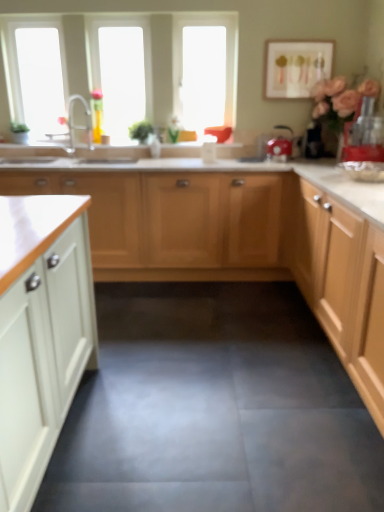
Question: Is matte white picture frame at upper right in front of or behind red plastic blender at right, which appears as the first appliance when viewed from the front, in the image?

Choices:
 (A) front
 (B) behind

Answer: (B)

Question: Is matte white picture frame at upper right spatially inside red plastic blender at right, which appears as the 2th appliance when viewed from the left, or outside of it?

Choices:
 (A) inside
 (B) outside

Answer: (B)

Question: Based on their relative distances, which object is farther from the red plastic blender at right, which appears as the first appliance when viewed from the front?

Choices:
 (A) shiny red kettle at center, the second appliance from the front
 (B) translucent glass vase at upper left
 (C) transparent glass window at upper left, which appears as the first window screen when viewed from the left
 (D) matte white picture frame at upper right
 (E) white wood cabinets at center

Answer: (C)

Question: Based on their relative distances, which object is nearer to the red plastic blender at right, which appears as the 1th appliance when viewed from the right?

Choices:
 (A) transparent glass window at upper left, which appears as the 2th window screen when viewed from the right
 (B) translucent glass vase at upper left
 (C) transparent glass window at upper center
 (D) silver metallic faucet at upper left
 (E) shiny red kettle at center, the second appliance from the front

Answer: (E)